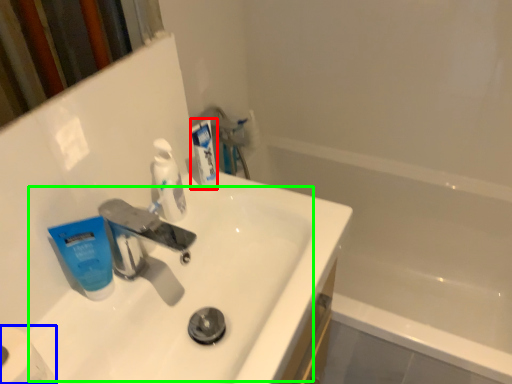
Question: Which object is the closest to the toothpaste (highlighted by a red box)? Choose among these: toilet paper (highlighted by a blue box) or sink (highlighted by a green box).

Choices:
 (A) toilet paper
 (B) sink

Answer: (B)